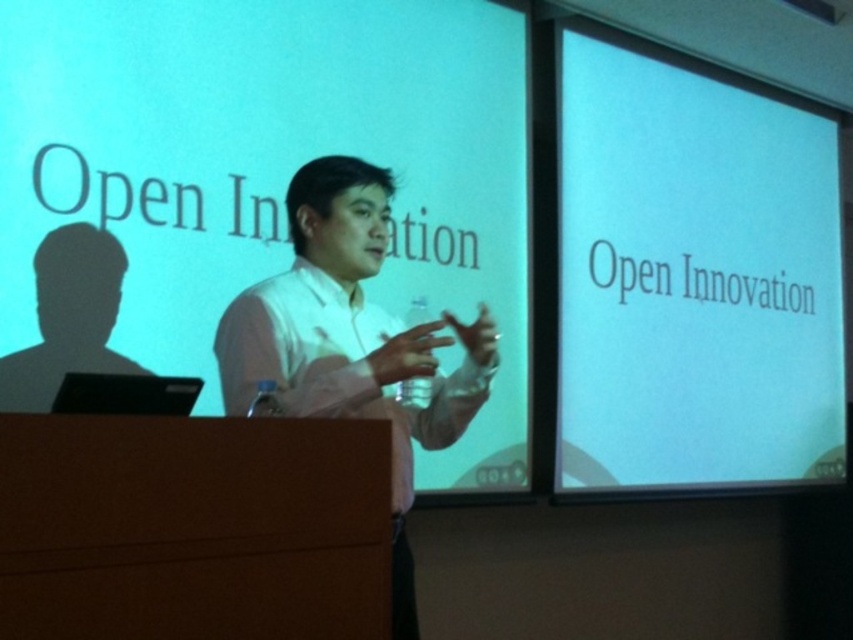
Identify the location of white matte projection screen at upper right. The height and width of the screenshot is (640, 853). (693, 276).

Who is shorter, white matte projection screen at upper right or white shirt at center?

white shirt at center

This screenshot has width=853, height=640. Describe the element at coordinates (693, 276) in the screenshot. I see `white matte projection screen at upper right` at that location.

The height and width of the screenshot is (640, 853). I want to click on white matte projection screen at upper right, so click(x=693, y=276).

Is point (328, 104) positioned behind point (91, 237)?

Yes, point (328, 104) is farther from viewer.

How far apart are matte white screen at upper center and black matte silhouette at left?

matte white screen at upper center is 16.60 inches away from black matte silhouette at left.

The width and height of the screenshot is (853, 640). Identify the location of matte white screen at upper center. (270, 168).

Does white shirt at center have a smaller size compared to black matte silhouette at left?

Actually, white shirt at center might be larger than black matte silhouette at left.

The width and height of the screenshot is (853, 640). Identify the location of white shirt at center. (350, 340).